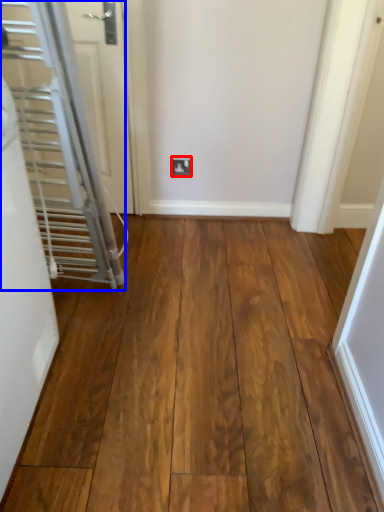
Question: Which point is further to the camera, electric outlet (highlighted by a red box) or door (highlighted by a blue box)?

Choices:
 (A) electric outlet
 (B) door

Answer: (A)